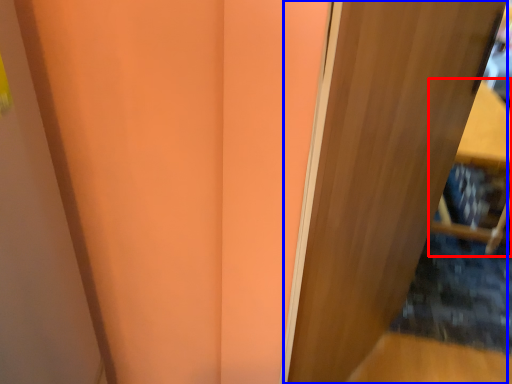
Question: Which object is further to the camera taking this photo, furniture (highlighted by a red box) or door (highlighted by a blue box)?

Choices:
 (A) furniture
 (B) door

Answer: (A)